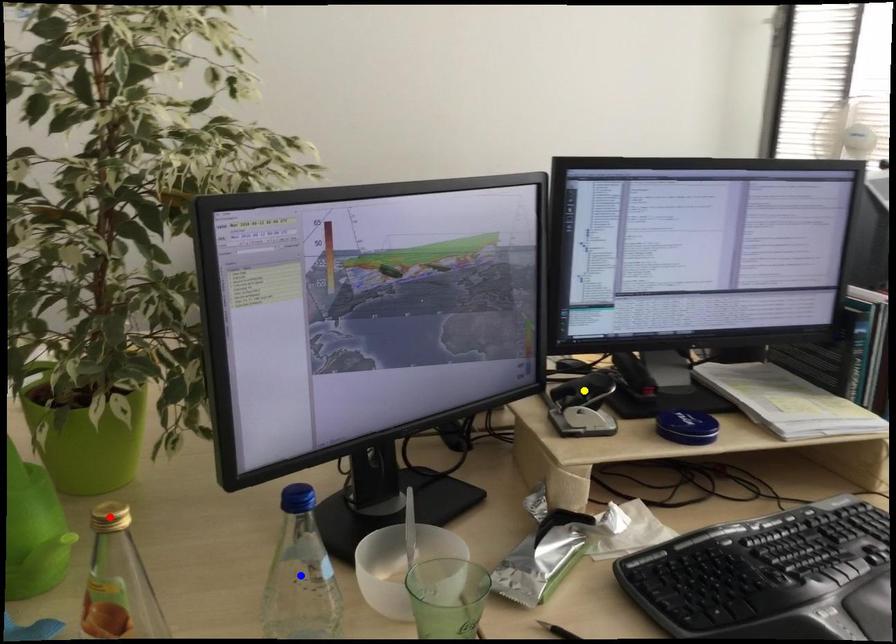
Order these from farthest to nearest:
A) blue point
B) red point
C) yellow point

yellow point < blue point < red point